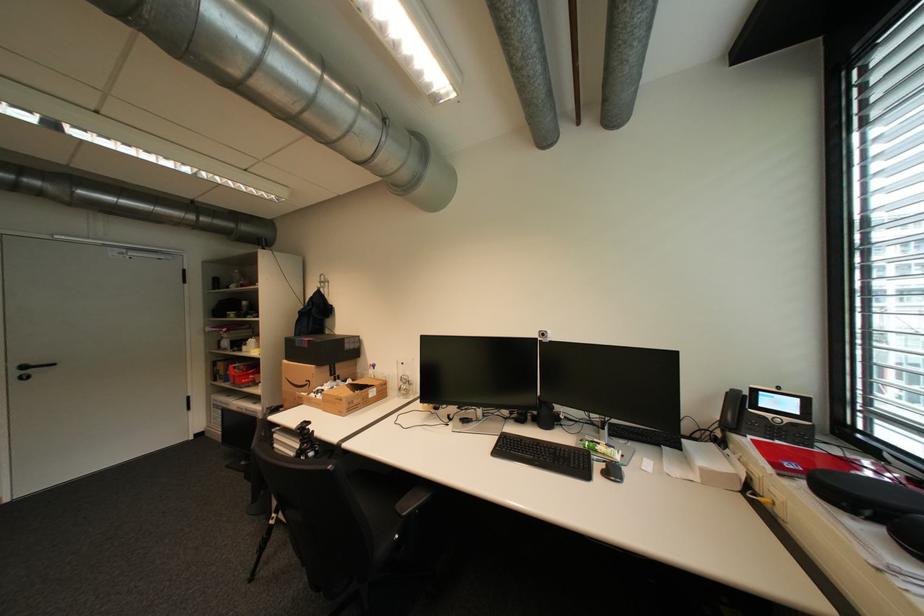
Identify the location of black chair sitting surface. This screenshot has height=616, width=924. (368, 539).